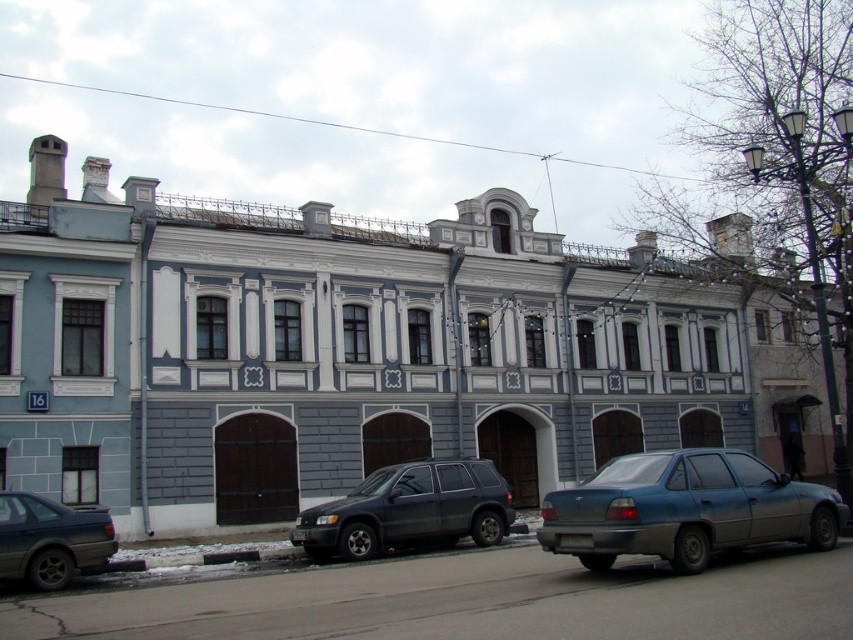
Between matte dark gray suv at center and matte black sedan at lower left, which one is positioned lower?

Positioned lower is matte dark gray suv at center.

Is the position of matte dark gray suv at center less distant than that of matte black sedan at lower left?

No, it is behind matte black sedan at lower left.

You are a GUI agent. You are given a task and a screenshot of the screen. Output one action in this format:
    pyautogui.click(x=<x>, y=<y>)
    Task: Click on the matte dark gray suv at center
    
    Given the screenshot: What is the action you would take?
    pyautogui.click(x=409, y=509)

Locate an element on the screen. This screenshot has width=853, height=640. matte dark gray suv at center is located at coordinates (409, 509).

Consider the image. Can you confirm if metallic gray sedan at lower right is positioned to the right of matte black sedan at lower left?

Indeed, metallic gray sedan at lower right is positioned on the right side of matte black sedan at lower left.

Who is positioned more to the left, metallic gray sedan at lower right or matte black sedan at lower left?

matte black sedan at lower left

Is point (741, 452) in front of point (10, 550)?

Yes, point (741, 452) is in front of point (10, 550).

Locate an element on the screen. The height and width of the screenshot is (640, 853). metallic gray sedan at lower right is located at coordinates (686, 508).

Can you confirm if metallic gray sedan at lower right is bigger than matte dark gray suv at center?

Correct, metallic gray sedan at lower right is larger in size than matte dark gray suv at center.

Does metallic gray sedan at lower right have a lesser width compared to matte dark gray suv at center?

Indeed, metallic gray sedan at lower right has a lesser width compared to matte dark gray suv at center.

At what (x,y) coordinates should I click in order to perform the action: click on metallic gray sedan at lower right. Please return your answer as a coordinate pair (x, y). The image size is (853, 640). Looking at the image, I should click on (686, 508).